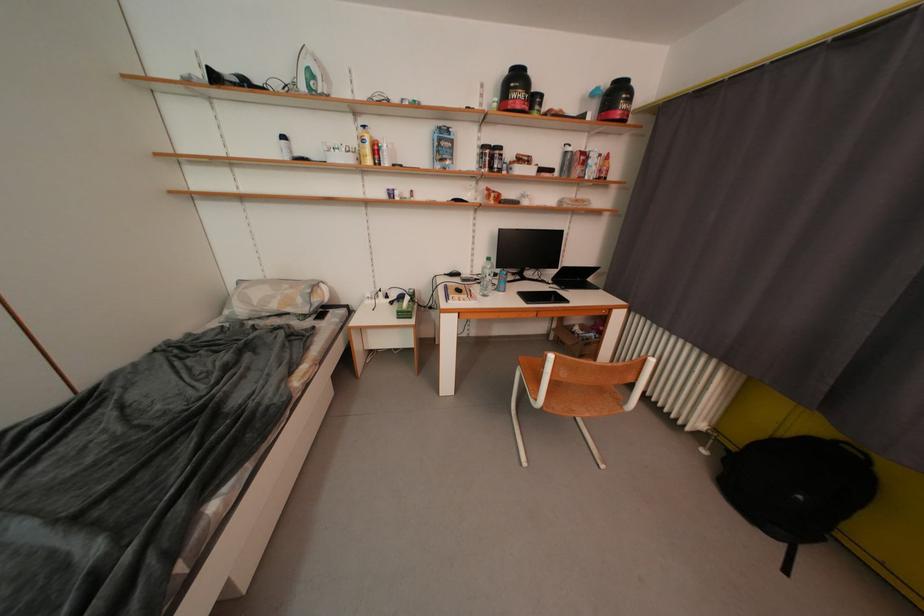
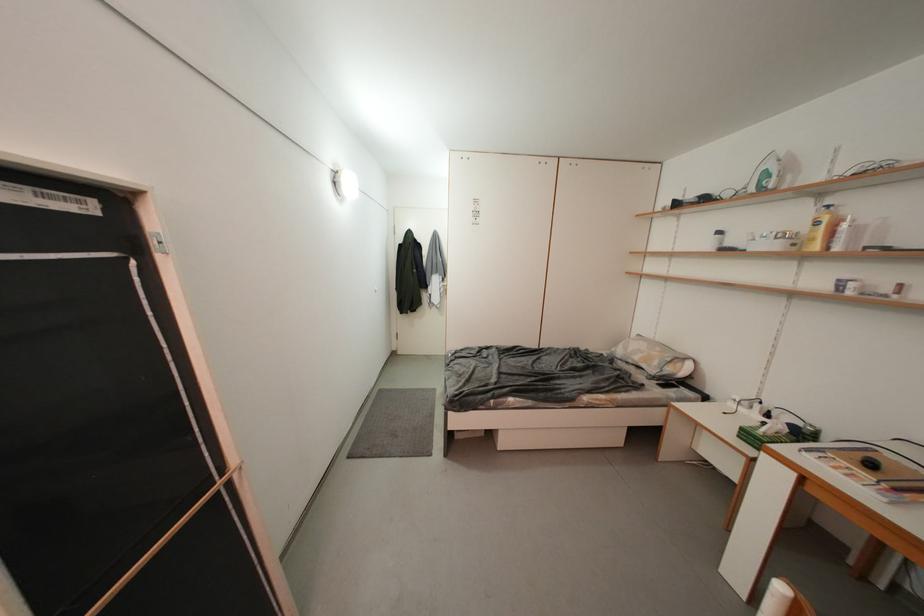
Question: The camera is either moving clockwise (left) or counter-clockwise (right) around the object. The first image is from the beginning of the video and the second image is from the end. Is the camera moving left or right when shooting the video?

Choices:
 (A) Left
 (B) Right

Answer: (B)